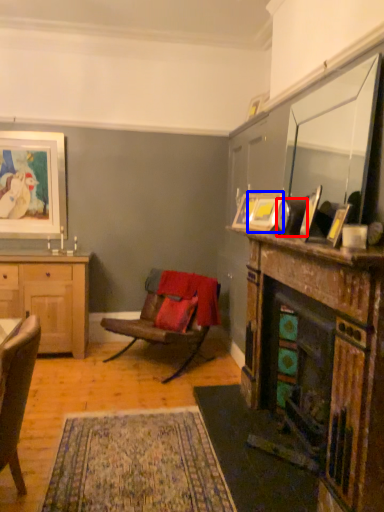
Question: Which of the following is the closest to the observer, corded phone (highlighted by a red box) or picture frame (highlighted by a blue box)?

Choices:
 (A) corded phone
 (B) picture frame

Answer: (A)